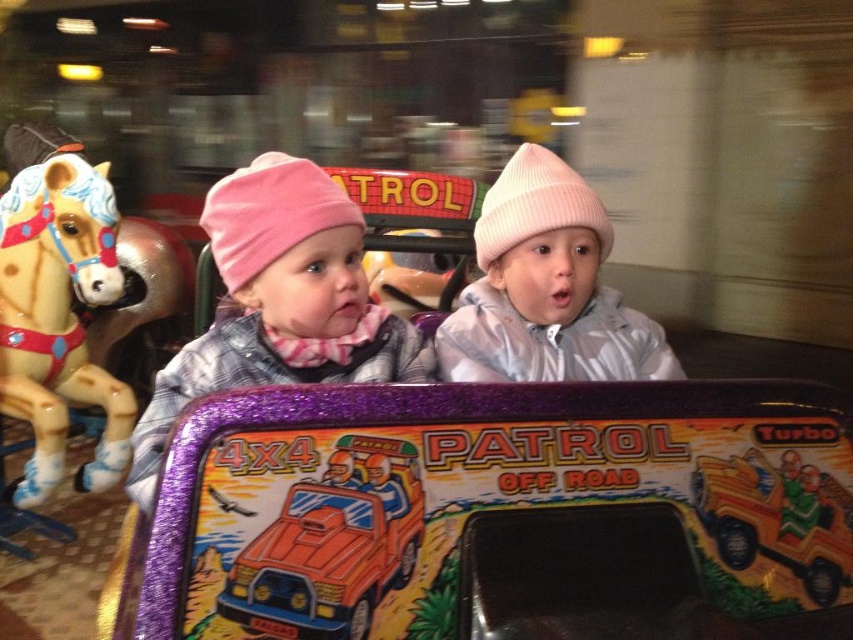
Question: Can you confirm if pink knit hat at upper left is positioned to the right of painted wood horse at left?

Choices:
 (A) yes
 (B) no

Answer: (A)

Question: Based on their relative distances, which object is nearer to the painted wood horse at left?

Choices:
 (A) orange matte plastic toy car at center
 (B) pink knit hat at upper left
 (C) pink knit hat at center

Answer: (B)

Question: Does pink knit hat at upper left appear over orange matte plastic toy car at center?

Choices:
 (A) yes
 (B) no

Answer: (A)

Question: Estimate the real-world distances between objects in this image. Which object is farther from the pink knit hat at upper left?

Choices:
 (A) orange matte plastic toy car at center
 (B) pink knit hat at center

Answer: (B)

Question: Estimate the real-world distances between objects in this image. Which object is farther from the pink knit hat at upper left?

Choices:
 (A) painted wood horse at left
 (B) pink knit hat at center

Answer: (A)

Question: Does painted wood horse at left appear on the left side of orange matte plastic toy car at center?

Choices:
 (A) no
 (B) yes

Answer: (B)